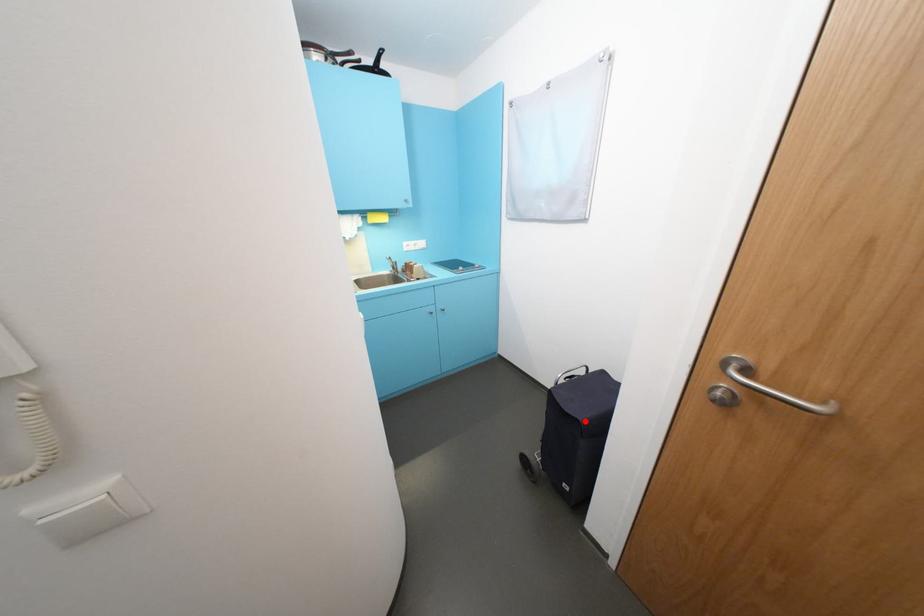
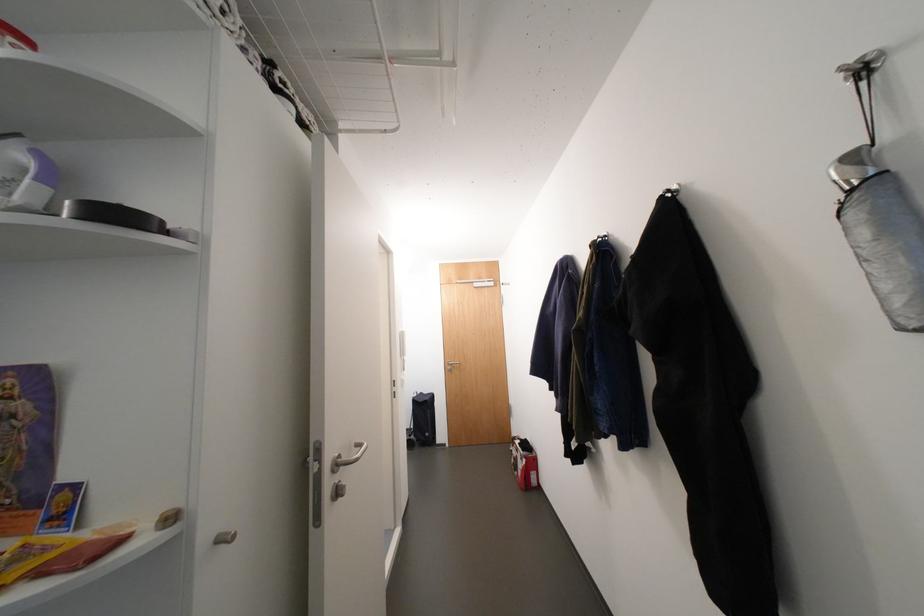
Find the pixel in the second image that matches the highlighted location in the first image.

(433, 402)